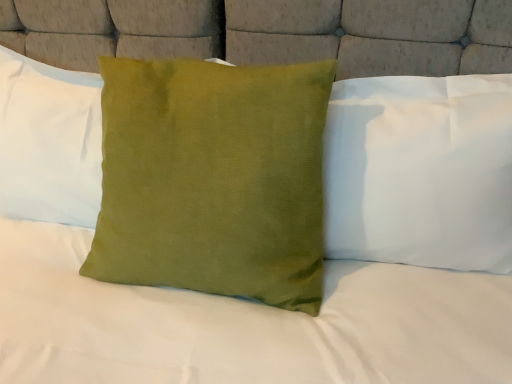
In order to face green velvet pillow at center, positioned as the first pillow in left-to-right order, should I rotate leftwards or rightwards?

Rotate left and turn 26.609 degrees.

Identify the location of satin green pillow at center, placed as the 1th pillow when sorted from right to left. This screenshot has height=384, width=512. (420, 171).

Does green velvet cushion at center, positioned as the 2th pillow in left-to-right order, come in front of satin green pillow at center, arranged as the third pillow when viewed from the left?

Yes, green velvet cushion at center, positioned as the 2th pillow in left-to-right order, is closer to the viewer.

From the picture: Can you confirm if green velvet cushion at center, marked as the second pillow in a right-to-left arrangement, is shorter than satin green pillow at center, placed as the 1th pillow when sorted from right to left?

No, green velvet cushion at center, marked as the second pillow in a right-to-left arrangement, is not shorter than satin green pillow at center, placed as the 1th pillow when sorted from right to left.

Is green velvet cushion at center, marked as the second pillow in a right-to-left arrangement, touching satin green pillow at center, arranged as the third pillow when viewed from the left?

No, green velvet cushion at center, marked as the second pillow in a right-to-left arrangement, is not touching satin green pillow at center, arranged as the third pillow when viewed from the left.

From the picture: How many degrees apart are the facing directions of green velvet cushion at center, positioned as the 2th pillow in left-to-right order, and satin green pillow at center, placed as the 1th pillow when sorted from right to left?

3.31 degrees separate the facing orientations of green velvet cushion at center, positioned as the 2th pillow in left-to-right order, and satin green pillow at center, placed as the 1th pillow when sorted from right to left.

Is satin green pillow at center, placed as the 1th pillow when sorted from right to left, wider than green velvet pillow at center, the 3th pillow when ordered from right to left?

Indeed, satin green pillow at center, placed as the 1th pillow when sorted from right to left, has a greater width compared to green velvet pillow at center, the 3th pillow when ordered from right to left.

The height and width of the screenshot is (384, 512). I want to click on the 1st pillow below the green velvet pillow at center, positioned as the first pillow in left-to-right order (from the image's perspective), so click(420, 171).

Is satin green pillow at center, placed as the 1th pillow when sorted from right to left, taller or shorter than green velvet pillow at center, the 3th pillow when ordered from right to left?

Considering their sizes, satin green pillow at center, placed as the 1th pillow when sorted from right to left, has more height than green velvet pillow at center, the 3th pillow when ordered from right to left.

Considering the relative positions of satin green pillow at center, placed as the 1th pillow when sorted from right to left, and green velvet pillow at center, positioned as the first pillow in left-to-right order, in the image provided, is satin green pillow at center, placed as the 1th pillow when sorted from right to left, in front of green velvet pillow at center, positioned as the first pillow in left-to-right order,?

Yes, it is in front of green velvet pillow at center, positioned as the first pillow in left-to-right order.

From the image's perspective, is green velvet cushion at center, marked as the second pillow in a right-to-left arrangement, below green velvet pillow at center, the 3th pillow when ordered from right to left?

Yes.

Is green velvet cushion at center, positioned as the 2th pillow in left-to-right order, oriented towards green velvet pillow at center, the 3th pillow when ordered from right to left?

No.

Is green velvet cushion at center, positioned as the 2th pillow in left-to-right order, positioned in front of green velvet pillow at center, the 3th pillow when ordered from right to left?

Yes, green velvet cushion at center, positioned as the 2th pillow in left-to-right order, is closer to the camera.

Does satin green pillow at center, arranged as the third pillow when viewed from the left, lie in front of green velvet cushion at center, marked as the second pillow in a right-to-left arrangement?

No, the depth of satin green pillow at center, arranged as the third pillow when viewed from the left, is greater than that of green velvet cushion at center, marked as the second pillow in a right-to-left arrangement.

Consider the image. Considering the positions of objects satin green pillow at center, arranged as the third pillow when viewed from the left, and green velvet cushion at center, positioned as the 2th pillow in left-to-right order, in the image provided, who is more to the right, satin green pillow at center, arranged as the third pillow when viewed from the left, or green velvet cushion at center, positioned as the 2th pillow in left-to-right order,?

From the viewer's perspective, satin green pillow at center, arranged as the third pillow when viewed from the left, appears more on the right side.

From a real-world perspective, starting from the green velvet cushion at center, positioned as the 2th pillow in left-to-right order, which pillow is the 1st one vertically above it? Please provide its 2D coordinates.

[(420, 171)]

Which is correct: satin green pillow at center, placed as the 1th pillow when sorted from right to left, is inside green velvet cushion at center, positioned as the 2th pillow in left-to-right order, or outside of it?

satin green pillow at center, placed as the 1th pillow when sorted from right to left, exists outside the volume of green velvet cushion at center, positioned as the 2th pillow in left-to-right order.

Between green velvet pillow at center, positioned as the first pillow in left-to-right order, and satin green pillow at center, placed as the 1th pillow when sorted from right to left, which one has larger size?

satin green pillow at center, placed as the 1th pillow when sorted from right to left.

From the image's perspective, between green velvet pillow at center, positioned as the first pillow in left-to-right order, and satin green pillow at center, placed as the 1th pillow when sorted from right to left, who is located below?

satin green pillow at center, placed as the 1th pillow when sorted from right to left, from the image's perspective.

From the picture: Who is more distant, green velvet pillow at center, the 3th pillow when ordered from right to left, or satin green pillow at center, arranged as the third pillow when viewed from the left?

green velvet pillow at center, the 3th pillow when ordered from right to left, is further away from the camera.

From a real-world perspective, is green velvet pillow at center, the 3th pillow when ordered from right to left, positioned above or below green velvet cushion at center, positioned as the 2th pillow in left-to-right order?

green velvet pillow at center, the 3th pillow when ordered from right to left, is above green velvet cushion at center, positioned as the 2th pillow in left-to-right order.

Is green velvet cushion at center, positioned as the 2th pillow in left-to-right order, completely or partially inside green velvet pillow at center, positioned as the first pillow in left-to-right order?

No.

Would you say green velvet pillow at center, the 3th pillow when ordered from right to left, is a long distance from green velvet cushion at center, positioned as the 2th pillow in left-to-right order?

Actually, green velvet pillow at center, the 3th pillow when ordered from right to left, and green velvet cushion at center, positioned as the 2th pillow in left-to-right order, are a little close together.

Identify the location of pillow that is under the satin green pillow at center, arranged as the third pillow when viewed from the left (from a real-world perspective). The image size is (512, 384). (213, 179).

Identify the location of pillow above the satin green pillow at center, placed as the 1th pillow when sorted from right to left (from the image's perspective). The width and height of the screenshot is (512, 384). (49, 142).

When comparing their distances from green velvet pillow at center, positioned as the first pillow in left-to-right order, does satin green pillow at center, placed as the 1th pillow when sorted from right to left, or green velvet cushion at center, positioned as the 2th pillow in left-to-right order, seem further?

satin green pillow at center, placed as the 1th pillow when sorted from right to left.

Looking at the image, which one is located further to satin green pillow at center, arranged as the third pillow when viewed from the left, green velvet pillow at center, the 3th pillow when ordered from right to left, or green velvet cushion at center, positioned as the 2th pillow in left-to-right order?

Among the two, green velvet pillow at center, the 3th pillow when ordered from right to left, is located further to satin green pillow at center, arranged as the third pillow when viewed from the left.

Looking at the image, which one is located closer to satin green pillow at center, arranged as the third pillow when viewed from the left, green velvet cushion at center, marked as the second pillow in a right-to-left arrangement, or green velvet pillow at center, the 3th pillow when ordered from right to left?

green velvet cushion at center, marked as the second pillow in a right-to-left arrangement, lies closer to satin green pillow at center, arranged as the third pillow when viewed from the left, than the other object.

Looking at the image, which one is located further to green velvet pillow at center, the 3th pillow when ordered from right to left, green velvet cushion at center, marked as the second pillow in a right-to-left arrangement, or satin green pillow at center, placed as the 1th pillow when sorted from right to left?

Among the two, satin green pillow at center, placed as the 1th pillow when sorted from right to left, is located further to green velvet pillow at center, the 3th pillow when ordered from right to left.

Based on their spatial positions, is green velvet pillow at center, the 3th pillow when ordered from right to left, or satin green pillow at center, arranged as the third pillow when viewed from the left, further from green velvet cushion at center, positioned as the 2th pillow in left-to-right order?

green velvet pillow at center, the 3th pillow when ordered from right to left.

When comparing their distances from green velvet cushion at center, positioned as the 2th pillow in left-to-right order, does satin green pillow at center, placed as the 1th pillow when sorted from right to left, or green velvet pillow at center, positioned as the first pillow in left-to-right order, seem further?

green velvet pillow at center, positioned as the first pillow in left-to-right order, lies further to green velvet cushion at center, positioned as the 2th pillow in left-to-right order, than the other object.

Image resolution: width=512 pixels, height=384 pixels. I want to click on pillow located between green velvet pillow at center, the 3th pillow when ordered from right to left, and satin green pillow at center, placed as the 1th pillow when sorted from right to left, in the left-right direction, so click(x=213, y=179).